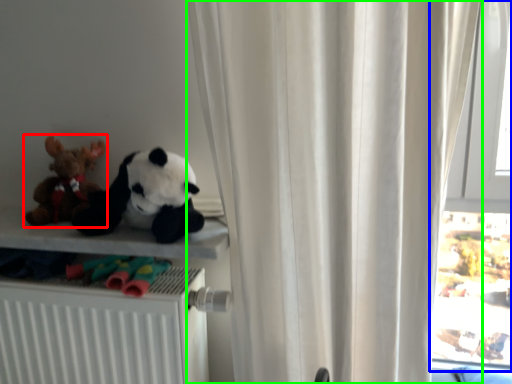
Question: Which object is the farthest from toy (highlighted by a red box)? Choose among these: window (highlighted by a blue box) or curtain (highlighted by a green box).

Choices:
 (A) window
 (B) curtain

Answer: (A)